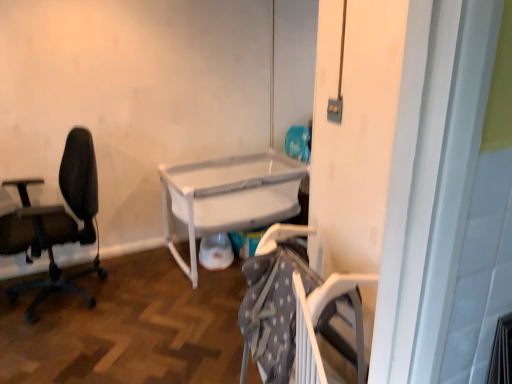
Measure the distance between white plastic crib at center and camera.

white plastic crib at center and camera are 2.78 meters apart.

What do you see at coordinates (57, 222) in the screenshot? I see `black mesh office chair at left` at bounding box center [57, 222].

At what (x,y) coordinates should I click in order to perform the action: click on white plastic screen door at center. Please return your answer as a coordinate pair (x, y). Looking at the image, I should click on (354, 132).

At what (x,y) coordinates should I click in order to perform the action: click on screen door in front of the white plastic crib at center. Please return your answer as a coordinate pair (x, y). Looking at the image, I should click on (354, 132).

Which object is thinner, white plastic crib at center or white plastic screen door at center?

With smaller width is white plastic screen door at center.

Which of these two, white plastic crib at center or white plastic screen door at center, is bigger?

Bigger between the two is white plastic crib at center.

Can you confirm if white plastic crib at center is taller than white plastic screen door at center?

No.

Between white plastic screen door at center and white plastic crib at center, which one appears on the right side from the viewer's perspective?

white plastic screen door at center is more to the right.

Is white plastic screen door at center spatially inside white plastic crib at center, or outside of it?

white plastic screen door at center is located beyond the bounds of white plastic crib at center.

Does white plastic screen door at center have a smaller size compared to white plastic crib at center?

Yes, white plastic screen door at center is smaller than white plastic crib at center.

From the image's perspective, between white plastic screen door at center and white plastic crib at center, which one is located above?

white plastic crib at center appears higher in the image.

Is point (236, 159) in front of point (67, 163)?

No, (236, 159) is behind (67, 163).

Find the location of a particular element. Image resolution: width=512 pixels, height=384 pixels. chair on the left of white plastic crib at center is located at coordinates (57, 222).

How many degrees apart are the facing directions of white plastic crib at center and black mesh office chair at left?

There is a 76-degree angle between the facing directions of white plastic crib at center and black mesh office chair at left.

Is white plastic crib at center positioned beyond the bounds of black mesh office chair at left?

Yes, white plastic crib at center is located beyond the bounds of black mesh office chair at left.

Based on their sizes in the image, would you say white plastic screen door at center is bigger or smaller than black mesh office chair at left?

white plastic screen door at center is smaller than black mesh office chair at left.

Which is more to the right, white plastic screen door at center or black mesh office chair at left?

Positioned to the right is white plastic screen door at center.

Considering the relative sizes of white plastic screen door at center and black mesh office chair at left in the image provided, is white plastic screen door at center shorter than black mesh office chair at left?

Incorrect, the height of white plastic screen door at center does not fall short of that of black mesh office chair at left.

Which is correct: black mesh office chair at left is inside white plastic screen door at center, or outside of it?

black mesh office chair at left cannot be found inside white plastic screen door at center.

From their relative heights in the image, would you say black mesh office chair at left is taller or shorter than white plastic screen door at center?

Clearly, black mesh office chair at left is shorter compared to white plastic screen door at center.

Considering the sizes of objects black mesh office chair at left and white plastic screen door at center in the image provided, who is wider, black mesh office chair at left or white plastic screen door at center?

With larger width is black mesh office chair at left.

Relative to white plastic screen door at center, is black mesh office chair at left in front or behind?

In the image, black mesh office chair at left appears behind white plastic screen door at center.

In the image, is black mesh office chair at left on the left side or the right side of white plastic crib at center?

black mesh office chair at left is positioned on white plastic crib at center's left side.

From the image's perspective, is black mesh office chair at left located above or below white plastic crib at center?

From the image's perspective, black mesh office chair at left appears below white plastic crib at center.

Is black mesh office chair at left closer to camera compared to white plastic crib at center?

Yes, the depth of black mesh office chair at left is less than that of white plastic crib at center.

Considering the relative sizes of black mesh office chair at left and white plastic crib at center in the image provided, is black mesh office chair at left wider than white plastic crib at center?

No.

Find the location of a particular element. This screenshot has height=384, width=512. screen door below the white plastic crib at center (from the image's perspective) is located at coordinates (354, 132).

Find the location of a particular element. This screenshot has height=384, width=512. screen door located above the white plastic crib at center (from a real-world perspective) is located at coordinates (354, 132).

Estimate the real-world distances between objects in this image. Which object is closer to white plastic screen door at center, white plastic crib at center or black mesh office chair at left?

white plastic crib at center.

From the image, which object appears to be farther from white plastic screen door at center, black mesh office chair at left or white plastic crib at center?

Based on the image, black mesh office chair at left appears to be further to white plastic screen door at center.

Based on their spatial positions, is black mesh office chair at left or white plastic screen door at center closer to white plastic crib at center?

black mesh office chair at left is closer to white plastic crib at center.

Considering their positions, is white plastic screen door at center positioned closer to white plastic crib at center than black mesh office chair at left?

Based on the image, black mesh office chair at left appears to be nearer to white plastic crib at center.

From the image, which object appears to be farther from black mesh office chair at left, white plastic screen door at center or white plastic crib at center?

white plastic screen door at center is positioned further to the anchor black mesh office chair at left.

Considering their positions, is white plastic crib at center positioned further to black mesh office chair at left than white plastic screen door at center?

white plastic screen door at center.

Identify the location of chair between white plastic screen door at center and white plastic crib at center from front to back. This screenshot has height=384, width=512. (57, 222).